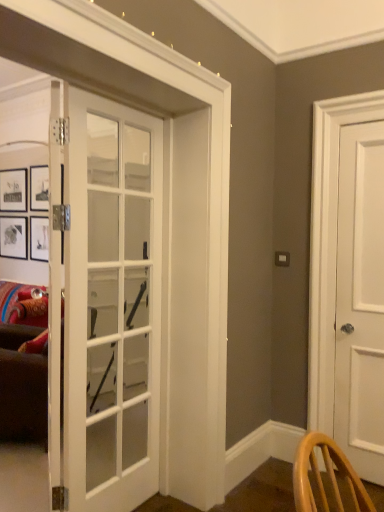
Question: Considering the relative sizes of white matte door at right, placed as the 1th door when sorted from back to front, and white glass door at center, which is the second door from right to left, in the image provided, is white matte door at right, placed as the 1th door when sorted from back to front, thinner than white glass door at center, which is the second door from right to left,?

Choices:
 (A) yes
 (B) no

Answer: (B)

Question: Does white matte door at right, the 2th door in the left-to-right sequence, have a greater height compared to white glass door at center, which is the 1th door from left to right?

Choices:
 (A) yes
 (B) no

Answer: (A)

Question: Can you confirm if white matte door at right, placed as the 1th door when sorted from back to front, is wider than white glass door at center, which is the second door from right to left?

Choices:
 (A) no
 (B) yes

Answer: (B)

Question: From a real-world perspective, does white matte door at right, the 1th door from the right, stand above white glass door at center, which is the 1th door from left to right?

Choices:
 (A) yes
 (B) no

Answer: (A)

Question: Are white matte door at right, which is the second door in front-to-back order, and white glass door at center, which is the 1th door from left to right, located far from each other?

Choices:
 (A) no
 (B) yes

Answer: (B)

Question: Is white matte door at right, the 1th door from the right, facing towards white glass door at center, which is the 1th door from left to right?

Choices:
 (A) no
 (B) yes

Answer: (A)

Question: Does white glass door at center, the first door viewed from the front, lie in front of white matte door at right, which is the second door in front-to-back order?

Choices:
 (A) no
 (B) yes

Answer: (B)

Question: Can you confirm if white glass door at center, which is the 1th door from left to right, is bigger than white matte door at right, the 1th door from the right?

Choices:
 (A) yes
 (B) no

Answer: (A)

Question: From a real-world perspective, is white glass door at center, which is the second door from right to left, over white matte door at right, the 1th door from the right?

Choices:
 (A) no
 (B) yes

Answer: (A)

Question: Is white glass door at center, which is the second door from right to left, taller than white matte door at right, the 2th door in the left-to-right sequence?

Choices:
 (A) yes
 (B) no

Answer: (B)

Question: Is white glass door at center, positioned as the 2th door in back-to-front order, facing towards white matte door at right, placed as the 1th door when sorted from back to front?

Choices:
 (A) no
 (B) yes

Answer: (A)

Question: Can you confirm if white glass door at center, the first door viewed from the front, is wider than white matte door at right, which is the second door in front-to-back order?

Choices:
 (A) yes
 (B) no

Answer: (B)

Question: Is point (117, 117) closer or farther from the camera than point (336, 355)?

Choices:
 (A) closer
 (B) farther

Answer: (A)